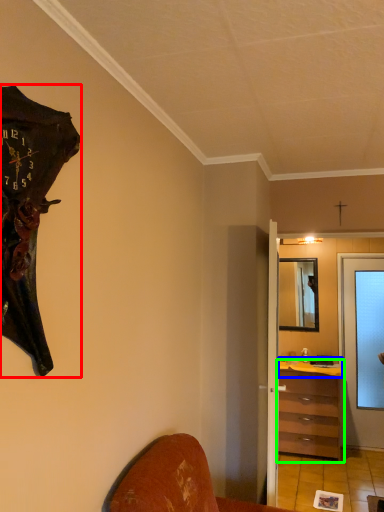
Question: Estimate the real-world distances between objects in this image. Which object is farther from wall clock (highlighted by a red box), counter top (highlighted by a blue box) or chest of drawers (highlighted by a green box)?

Choices:
 (A) counter top
 (B) chest of drawers

Answer: (A)